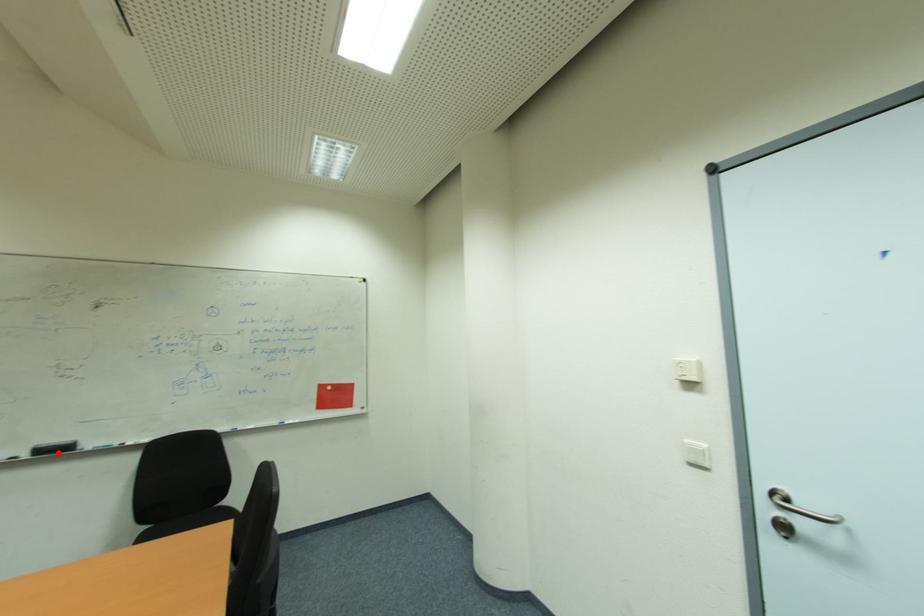
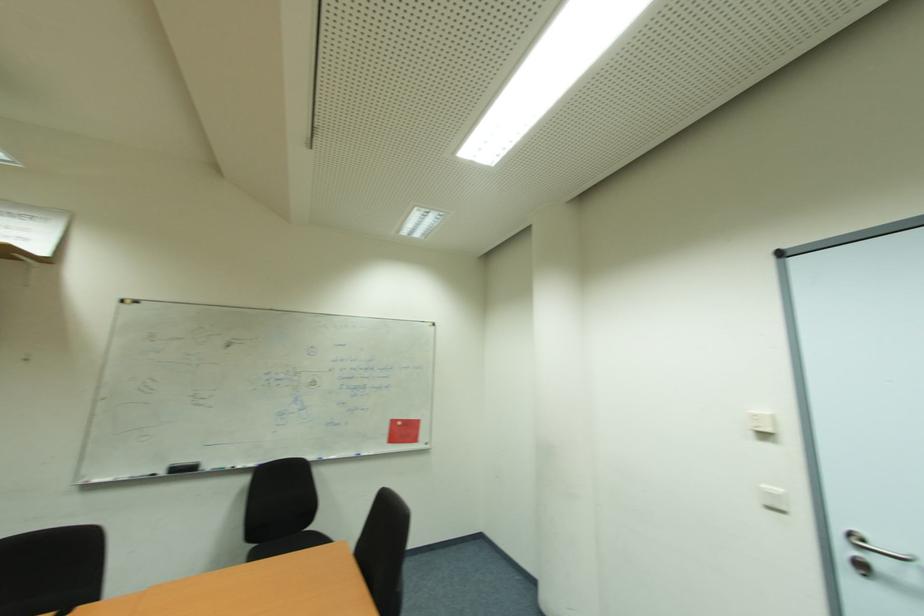
Question: I am providing you with two images of the same scene from different viewpoints. Image1 has a red point marked. In image2, the corresponding 3D location appears at what relative position? Reply with the corresponding letter.

Choices:
 (A) Closer
 (B) Farther

Answer: (B)